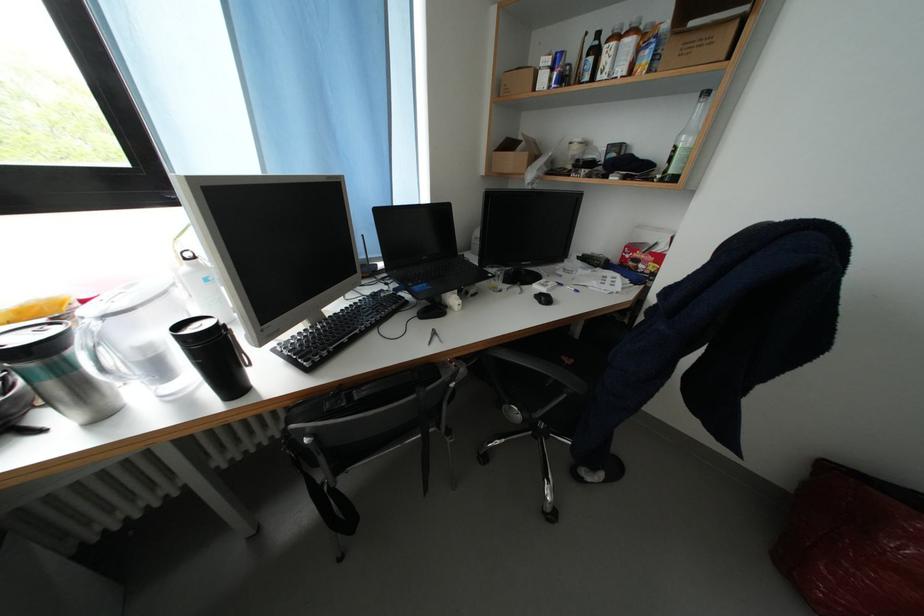
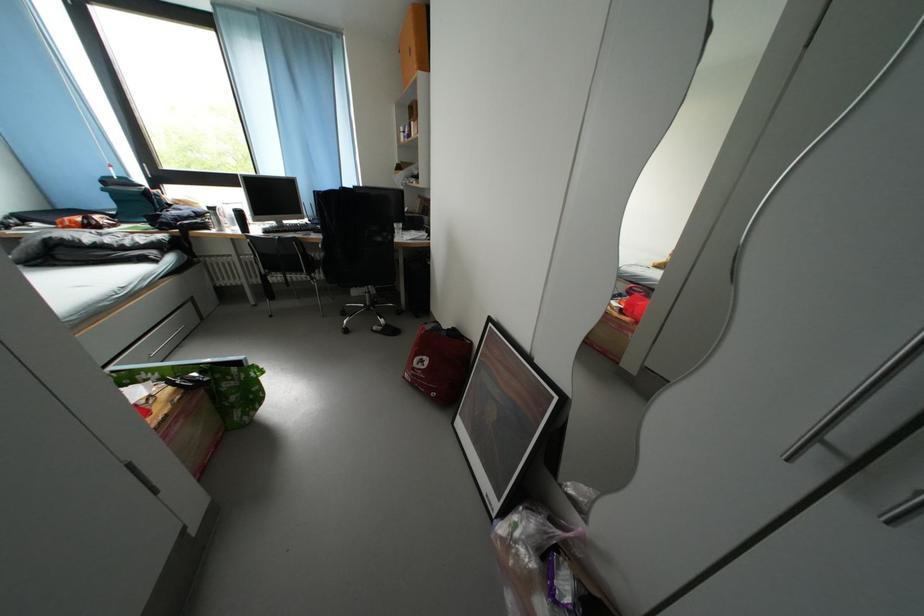
Question: The images are taken continuously from a first-person perspective. In which direction are you moving?

Choices:
 (A) Left
 (B) Right
 (C) Forward
 (D) Backward

Answer: (B)